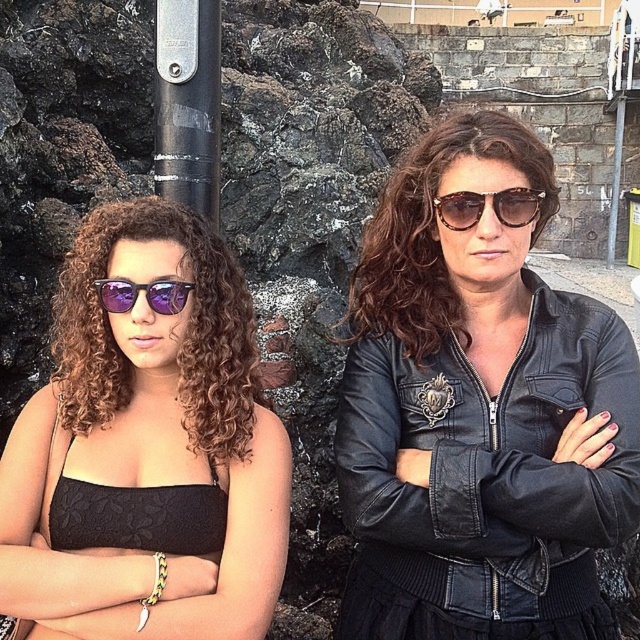
You are a photographer trying to capture a closeup of the black leather jacket at center and the purple reflective sunglasses at left. Since you want to focus on both items, which one should you adjust your camera lens to prioritize focusing on first, considering their sizes in the frame?

The black leather jacket at center is taller than the purple reflective sunglasses at left, so you should prioritize focusing on the black leather jacket at center first as it occupies more space in the frame.

You are a photographer setting up for a shoot. You need to position a light source above the matte black top at center without it casting a shadow from the black metallic pole at upper center. Is this possible?

The matte black top at center is located below the black metallic pole at upper center. Since the pole is above the top, positioning a light source above the top might still cast a shadow from the pole unless the light is placed in a way that avoids the pole obstructing the light path. However, since the pole is already above the top, it would likely cast a shadow unless moved or the light is positioned to the side. Therefore, it might not be possible without repositioning the pole or using additional light